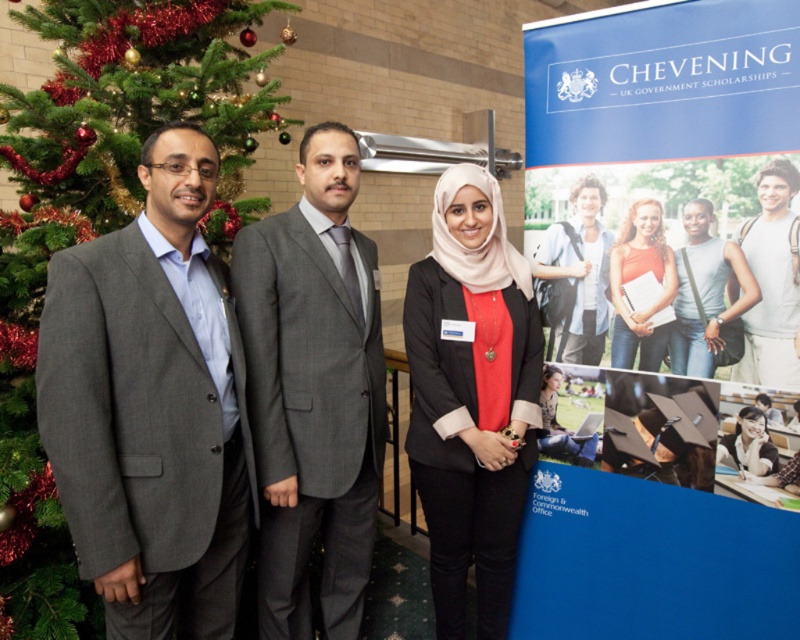
Between matte gray tank top at center and matte black laptop at center, which one has more height?

matte gray tank top at center

Who is more forward, (678,358) or (728,454)?

Point (728,454) is in front.

Between point (680, 294) and point (742, 451), which one is positioned in front?

Positioned in front is point (742, 451).

This screenshot has width=800, height=640. I want to click on matte gray tank top at center, so click(708, 296).

Is matte pink hijab at center to the right of light blue denim shirt at center from the viewer's perspective?

Correct, you'll find matte pink hijab at center to the right of light blue denim shirt at center.

Between matte pink hijab at center and light blue denim shirt at center, which one has less height?

light blue denim shirt at center is shorter.

Find the location of a particular element. The height and width of the screenshot is (640, 800). matte pink hijab at center is located at coordinates (688, 266).

Does gray woolen suit at left appear on the left side of matte pink hijab at center?

Yes, gray woolen suit at left is to the left of matte pink hijab at center.

Between gray woolen suit at left and matte pink hijab at center, which one appears on the right side from the viewer's perspective?

Positioned to the right is matte pink hijab at center.

Is point (204, 323) closer to viewer compared to point (598, 349)?

That is True.

Where is `gray woolen suit at left`? Image resolution: width=800 pixels, height=640 pixels. gray woolen suit at left is located at coordinates (148, 428).